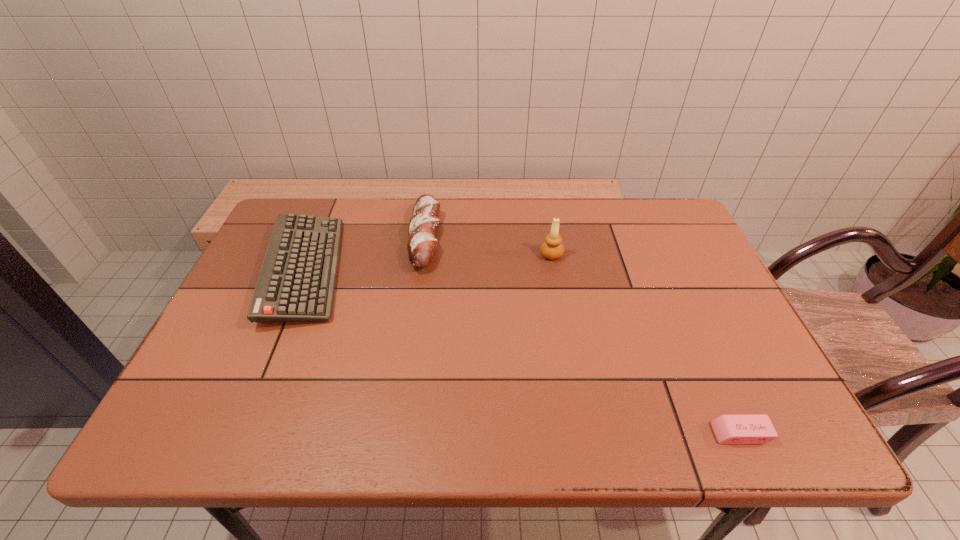
Find the location of a particular element. the tallest object is located at coordinates (552, 248).

You are a GUI agent. You are given a task and a screenshot of the screen. Output one action in this format:
    pyautogui.click(x=<x>, y=<y>)
    Task: Click on the second object from right to left
    
    Given the screenshot: What is the action you would take?
    pyautogui.click(x=552, y=248)

This screenshot has width=960, height=540. I want to click on the second object from left to right, so click(x=423, y=225).

You are a GUI agent. You are given a task and a screenshot of the screen. Output one action in this format:
    pyautogui.click(x=<x>, y=<y>)
    Task: Click on the leftmost object
    
    Given the screenshot: What is the action you would take?
    [297, 280]

Locate an element on the screen. This screenshot has width=960, height=540. computer keyboard is located at coordinates (297, 280).

Locate an element on the screen. The width and height of the screenshot is (960, 540). the shortest object is located at coordinates (729, 429).

Locate an element on the screen. This screenshot has height=540, width=960. eraser is located at coordinates (729, 429).

Identify the location of vacant space located on the front of the third object from left to right. The height and width of the screenshot is (540, 960). (569, 358).

Image resolution: width=960 pixels, height=540 pixels. What are the coordinates of `free space located on the front of the baguet` in the screenshot? It's located at (416, 302).

Locate an element on the screen. This screenshot has height=540, width=960. vacant space located on the right of the leftmost object is located at coordinates (403, 271).